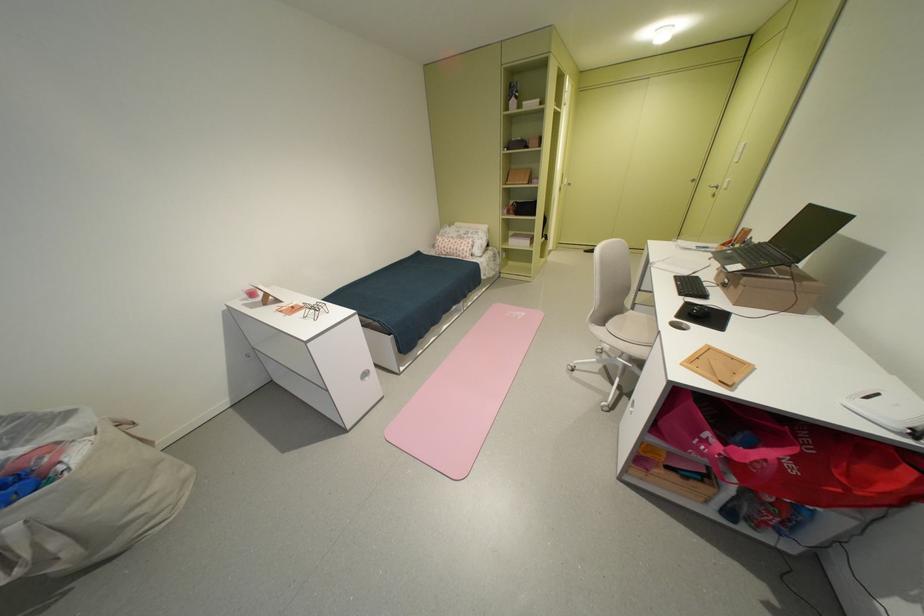
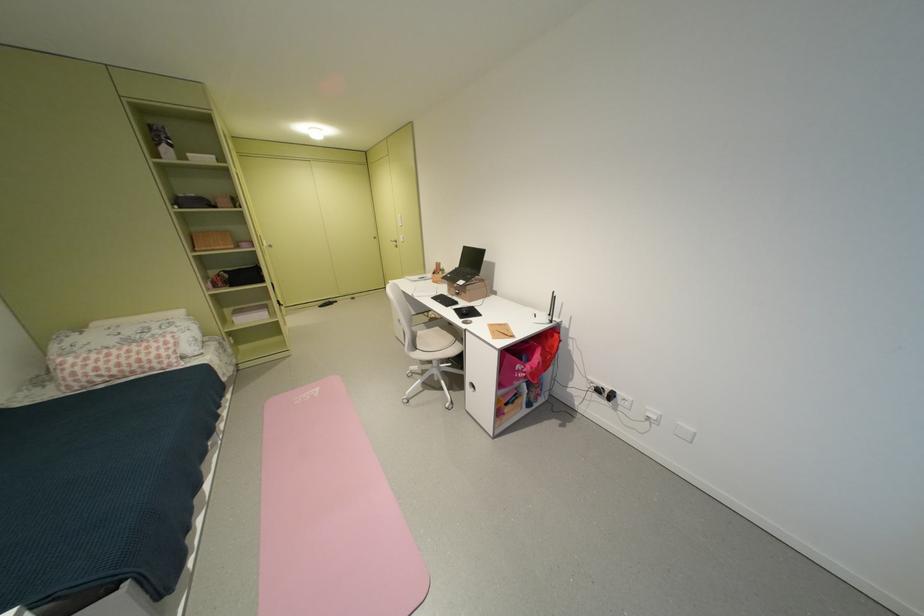
Find the pixel in the second image that matches point (747, 246) in the first image.

(450, 274)